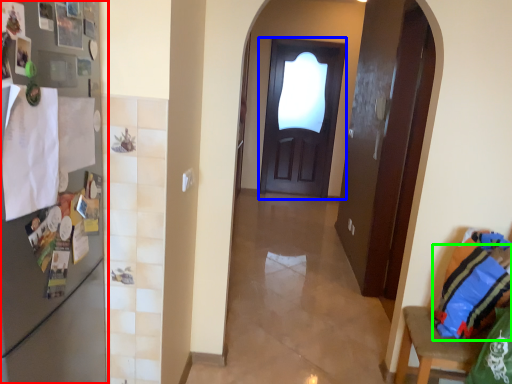
Question: Based on their relative distances, which object is farther from fridge (highlighted by a red box)? Choose from door (highlighted by a blue box) and pillow (highlighted by a green box).

Choices:
 (A) door
 (B) pillow

Answer: (A)